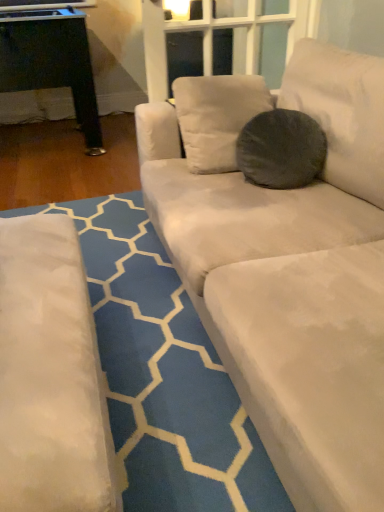
Question: Is dark gray fuzzy pillow at center taller than white fabric couch at lower right?

Choices:
 (A) no
 (B) yes

Answer: (B)

Question: From a real-world perspective, is dark gray fuzzy pillow at center over white fabric couch at lower right?

Choices:
 (A) no
 (B) yes

Answer: (B)

Question: Considering the relative sizes of dark gray fuzzy pillow at center and white fabric couch at lower right in the image provided, is dark gray fuzzy pillow at center wider than white fabric couch at lower right?

Choices:
 (A) no
 (B) yes

Answer: (A)

Question: From a real-world perspective, is dark gray fuzzy pillow at center below white fabric couch at lower right?

Choices:
 (A) no
 (B) yes

Answer: (A)

Question: Is dark gray fuzzy pillow at center in front of white fabric couch at lower right?

Choices:
 (A) yes
 (B) no

Answer: (B)

Question: Does dark gray fuzzy pillow at center appear on the right side of white fabric couch at lower right?

Choices:
 (A) yes
 (B) no

Answer: (A)

Question: From a real-world perspective, is white fabric couch at lower right located beneath dark gray fuzzy pillow at center?

Choices:
 (A) no
 (B) yes

Answer: (B)

Question: Can you confirm if white fabric couch at lower right is positioned to the left of dark gray fuzzy pillow at center?

Choices:
 (A) no
 (B) yes

Answer: (B)

Question: Can you confirm if white fabric couch at lower right is shorter than dark gray fuzzy pillow at center?

Choices:
 (A) no
 (B) yes

Answer: (B)

Question: Can you confirm if white fabric couch at lower right is smaller than dark gray fuzzy pillow at center?

Choices:
 (A) yes
 (B) no

Answer: (B)

Question: Is white fabric couch at lower right further to the viewer compared to dark gray fuzzy pillow at center?

Choices:
 (A) no
 (B) yes

Answer: (A)

Question: From a real-world perspective, is white fabric couch at lower right on dark gray fuzzy pillow at center?

Choices:
 (A) no
 (B) yes

Answer: (A)

Question: Considering the positions of white fabric couch at lower right and dark gray fuzzy pillow at center in the image, is white fabric couch at lower right bigger or smaller than dark gray fuzzy pillow at center?

Choices:
 (A) big
 (B) small

Answer: (A)